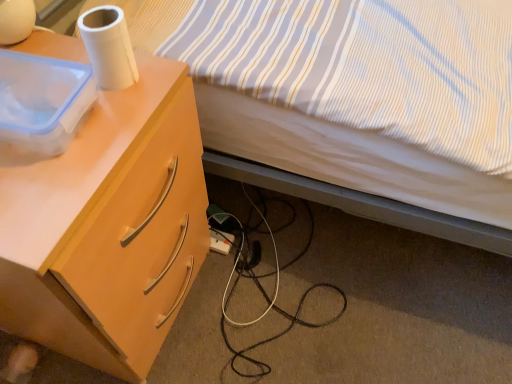
Identify the location of free space to the right of transparent plastic container at upper left. (130, 120).